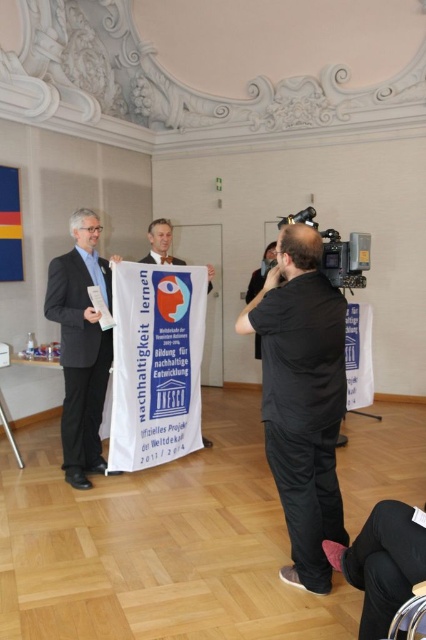
You are attending a formal event and notice two people in black attire. One is wearing a black matte shirt at center and the other a matte black suit at left. From your perspective, which one is positioned to the right?

The black matte shirt at center is positioned to the right of the matte black suit at left.

You are a photographer at the event and need to ensure both the black matte shirt at center and the matte black suit at left are clearly visible in the photo. Which clothing item is shorter in height?

The black matte shirt at center is shorter in height than the matte black suit at left because it is not as tall as the matte black suit at left.

You are organizing a photoshoot and need to ensure that the black matte shirt at center and the matte black suit at left are framed properly. Which object is wider so that you can adjust the camera angle accordingly?

The black matte shirt at center is wider than the matte black suit at left, so you should adjust the camera angle to accommodate its greater width.